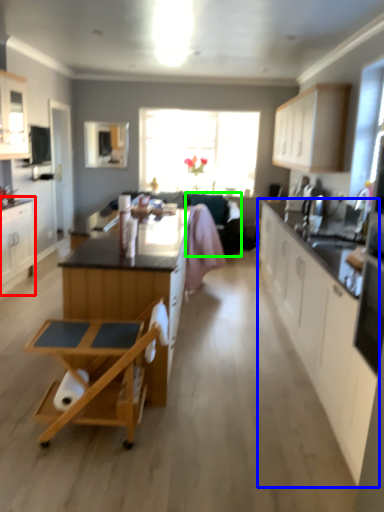
Question: Based on their relative distances, which object is farther from cabinetry (highlighted by a red box)? Choose from cabinetry (highlighted by a blue box) and armchair (highlighted by a green box).

Choices:
 (A) cabinetry
 (B) armchair

Answer: (A)